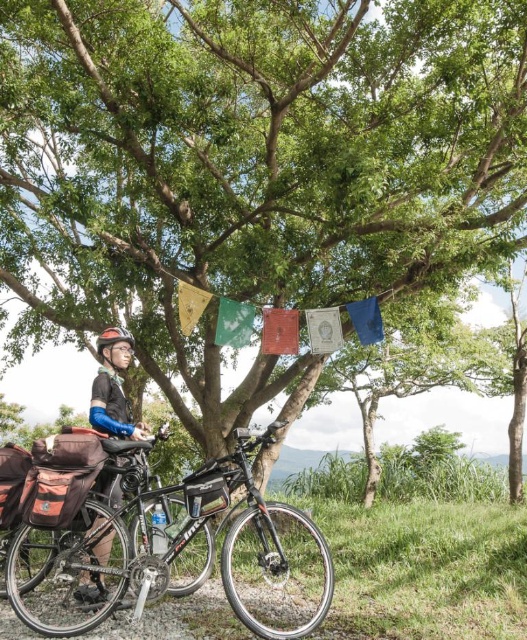
Question: Is the position of shiny metallic bicycle at center more distant than that of matte black helmet at upper left?

Choices:
 (A) yes
 (B) no

Answer: (B)

Question: Which point appears closest to the camera in this image?

Choices:
 (A) (114, 412)
 (B) (310, 593)

Answer: (B)

Question: Does shiny metallic bicycle at center appear over matte black helmet at upper left?

Choices:
 (A) yes
 (B) no

Answer: (B)

Question: Which object appears farthest from the camera in this image?

Choices:
 (A) shiny metallic bicycle at center
 (B) matte black helmet at upper left

Answer: (B)

Question: From the image, what is the correct spatial relationship of shiny metallic bicycle at center in relation to matte black helmet at upper left?

Choices:
 (A) right
 (B) left

Answer: (A)